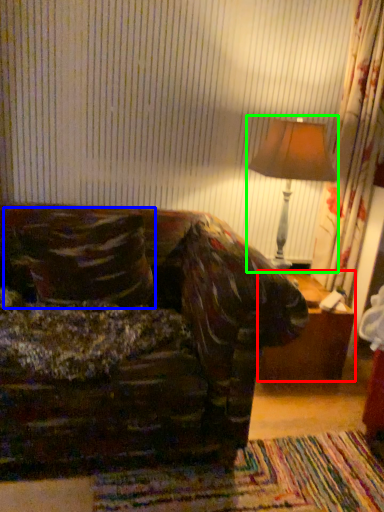
Question: Which object is positioned closest to table (highlighted by a red box)? Select from throw pillow (highlighted by a blue box) and table lamp (highlighted by a green box).

Choices:
 (A) throw pillow
 (B) table lamp

Answer: (B)